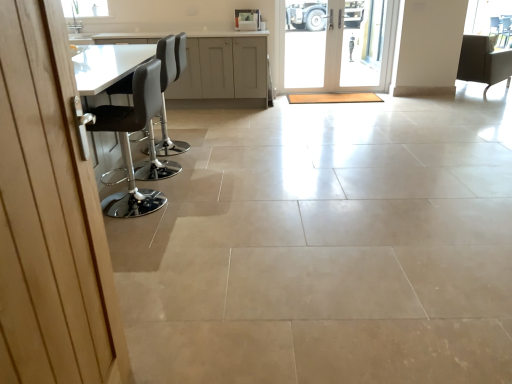
Question: Is point (181, 74) positioned closer to the camera than point (489, 67)?

Choices:
 (A) farther
 (B) closer

Answer: (B)

Question: Is matte gray cabinets at upper center spatially inside matte black chair at upper right, the 3th chair in the left-to-right sequence, or outside of it?

Choices:
 (A) inside
 (B) outside

Answer: (B)

Question: Which of these objects is positioned closest to the wooden door at left, acting as the first door starting from the bottom?

Choices:
 (A) white glass door at center, the second door from the left
 (B) white leather bar stool at left, the third chair positioned from the right
 (C) transparent glass window screen at upper right
 (D) black leather stool at left, which ranks as the 3th chair in back-to-front order
 (E) matte black chair at upper right, which is the 1th chair in right-to-left order

Answer: (D)

Question: Estimate the real-world distances between objects in this image. Which object is closer to the white leather bar stool at left, which appears as the second chair when viewed from the back?

Choices:
 (A) black leather stool at left, the first chair when ordered from front to back
 (B) wooden door at left, acting as the first door starting from the bottom
 (C) matte gray cabinets at upper center
 (D) transparent glass window screen at upper right
 (E) white glass door at center, which appears as the 1th door when viewed from the back

Answer: (A)